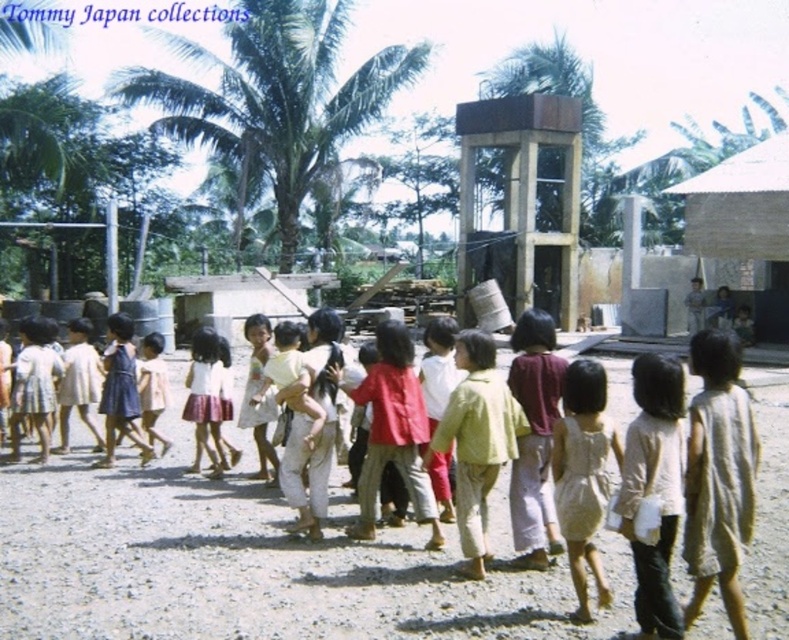
You are a photographer trying to capture a group photo of the children. You notice two children wearing a light yellow fabric shirt at center and a maroon fabric shirt at center. Given that the minimum distance required for a clear photo is 12 inches between subjects, can you determine if the two children are close enough to be in focus?

The light yellow fabric shirt at center is 14.48 inches from the maroon fabric shirt at center. Since the minimum distance required for a clear photo is 12 inches, the two children are within the required distance and can be in focus.

Based on the photo, you are standing at the position of point (129,435) and want to walk towards the palm trees in the background. There is a point at (131,528). Can you walk straight ahead without deviating from your path to the palm trees?

Yes, you can walk straight ahead without deviating because point (131,528) is in front of point (129,435), meaning it lies along your path towards the palm trees.

You are standing at point point [208,620] and want to take a photo of the children using a camera that is 4.90 meters away. Will you be able to capture the entire group in the photo?

The distance between point [208,620] and the camera is exactly 4.90 meters. Whether the entire group can be captured depends on the camera lens and field of view, but the distance itself is sufficient if the camera can cover the group spread within that range.